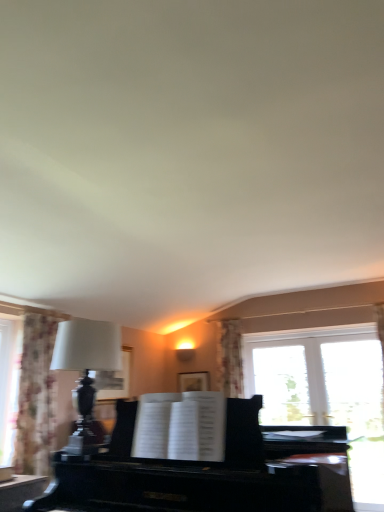
I want to click on matte black lamp at left, so click(87, 371).

How different are the orientations of black polished piano at center and floral fabric curtain at left in degrees?

The angle between the facing direction of black polished piano at center and the facing direction of floral fabric curtain at left is 88.3 degrees.

How far apart are black polished piano at center and floral fabric curtain at left?

4.12 feet.

Consider the image. From a real-world perspective, is black polished piano at center located higher than floral fabric curtain at left?

No.

Between point (64, 507) and point (28, 412), which one is positioned in front?

The point (64, 507) is closer.

Is floral fabric curtain at left wider than matte black lamp at left?

Correct, the width of floral fabric curtain at left exceeds that of matte black lamp at left.

Does floral fabric curtain at left turn towards matte black lamp at left?

No, floral fabric curtain at left is not aimed at matte black lamp at left.

Find the location of a particular element. This screenshot has height=512, width=384. table lamp on the right side of floral fabric curtain at left is located at coordinates (87, 371).

Between matte black lamp at left and black polished piano at center, which one has smaller size?

With smaller size is matte black lamp at left.

Which is more to the right, matte black lamp at left or black polished piano at center?

From the viewer's perspective, black polished piano at center appears more on the right side.

Which object is closer to the camera, matte black lamp at left or black polished piano at center?

black polished piano at center is closer to the camera.

From the image's perspective, who appears lower, black polished piano at center or matte black lamp at left?

From the image's view, black polished piano at center is below.

Looking at this image, considering the relative positions of black polished piano at center and matte black lamp at left in the image provided, is black polished piano at center to the left or to the right of matte black lamp at left?

Clearly, black polished piano at center is on the right of matte black lamp at left in the image.

The height and width of the screenshot is (512, 384). I want to click on piano lying in front of the matte black lamp at left, so coord(205,473).

Can you confirm if black polished piano at center is wider than matte black lamp at left?

Correct, the width of black polished piano at center exceeds that of matte black lamp at left.

You are a GUI agent. You are given a task and a screenshot of the screen. Output one action in this format:
    pyautogui.click(x=<x>, y=<y>)
    Task: Click on the curtain that appears on the left of matte black lamp at left
    This screenshot has height=512, width=384.
    Given the screenshot: What is the action you would take?
    pyautogui.click(x=35, y=395)

Is matte black lamp at left not within floral fabric curtain at left?

matte black lamp at left is positioned outside floral fabric curtain at left.

Is matte black lamp at left with floral fabric curtain at left?

No, matte black lamp at left is not making contact with floral fabric curtain at left.

Is floral fabric curtain at left completely or partially outside of black polished piano at center?

Yes, floral fabric curtain at left is not within black polished piano at center.

Considering the positions of objects floral fabric curtain at left and black polished piano at center in the image provided, who is behind, floral fabric curtain at left or black polished piano at center?

floral fabric curtain at left.

From the image's perspective, which one is positioned lower, floral fabric curtain at left or black polished piano at center?

black polished piano at center.

This screenshot has height=512, width=384. Find the location of `curtain located above the black polished piano at center (from the image's perspective)`. curtain located above the black polished piano at center (from the image's perspective) is located at coordinates (35, 395).

Identify the location of curtain to the left of black polished piano at center. Image resolution: width=384 pixels, height=512 pixels. (35, 395).

This screenshot has width=384, height=512. I want to click on curtain lying below the matte black lamp at left (from the image's perspective), so click(x=35, y=395).

Estimate the real-world distances between objects in this image. Which object is closer to floral fabric curtain at left, black polished piano at center or matte black lamp at left?

The object closer to floral fabric curtain at left is matte black lamp at left.

Looking at the image, which one is located further to black polished piano at center, floral fabric curtain at left or matte black lamp at left?

Based on the image, floral fabric curtain at left appears to be further to black polished piano at center.

Which object lies further to the anchor point matte black lamp at left, floral fabric curtain at left or black polished piano at center?

floral fabric curtain at left is further to matte black lamp at left.

Based on their spatial positions, is matte black lamp at left or black polished piano at center closer to floral fabric curtain at left?

Based on the image, matte black lamp at left appears to be nearer to floral fabric curtain at left.

When comparing their distances from black polished piano at center, does matte black lamp at left or floral fabric curtain at left seem further?

Among the two, floral fabric curtain at left is located further to black polished piano at center.

From the image, which object appears to be farther from matte black lamp at left, black polished piano at center or floral fabric curtain at left?

floral fabric curtain at left.

Locate an element on the screen. The width and height of the screenshot is (384, 512). table lamp positioned between black polished piano at center and floral fabric curtain at left from near to far is located at coordinates (87, 371).